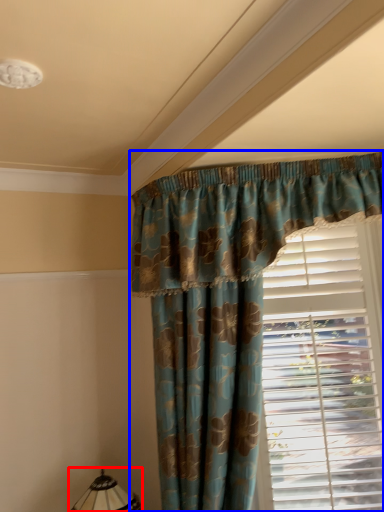
Question: Which point is closer to the camera, table lamp (highlighted by a red box) or curtain (highlighted by a blue box)?

Choices:
 (A) table lamp
 (B) curtain

Answer: (B)